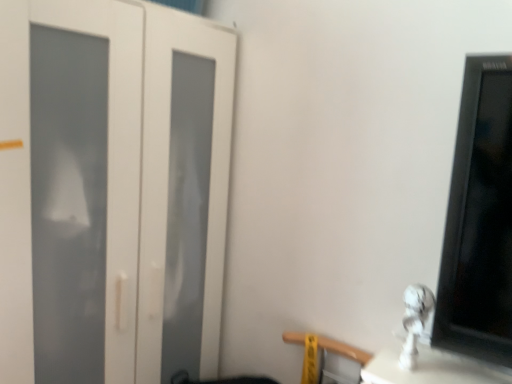
Question: Is white glossy statue at lower right outside white matte door at left?

Choices:
 (A) no
 (B) yes

Answer: (B)

Question: Can you confirm if white glossy statue at lower right is positioned to the left of white matte door at left?

Choices:
 (A) no
 (B) yes

Answer: (A)

Question: From the image's perspective, is white glossy statue at lower right located beneath white matte door at left?

Choices:
 (A) no
 (B) yes

Answer: (B)

Question: Is white glossy statue at lower right next to white matte door at left and touching it?

Choices:
 (A) no
 (B) yes

Answer: (A)

Question: Is white matte door at left inside white glossy statue at lower right?

Choices:
 (A) no
 (B) yes

Answer: (A)

Question: Does white glossy statue at lower right have a greater height compared to white matte door at left?

Choices:
 (A) no
 (B) yes

Answer: (A)

Question: Is wooden at lower right next to white glossy statue at lower right?

Choices:
 (A) no
 (B) yes

Answer: (A)

Question: Is the position of wooden at lower right less distant than that of white glossy statue at lower right?

Choices:
 (A) no
 (B) yes

Answer: (A)

Question: Is wooden at lower right outside white glossy statue at lower right?

Choices:
 (A) no
 (B) yes

Answer: (B)

Question: Is wooden at lower right at the left side of white glossy statue at lower right?

Choices:
 (A) no
 (B) yes

Answer: (B)

Question: Can you confirm if wooden at lower right is bigger than white glossy statue at lower right?

Choices:
 (A) no
 (B) yes

Answer: (B)

Question: Does wooden at lower right appear on the right side of white glossy statue at lower right?

Choices:
 (A) no
 (B) yes

Answer: (A)

Question: Can you confirm if white glossy statue at lower right is shorter than wooden at lower right?

Choices:
 (A) yes
 (B) no

Answer: (A)